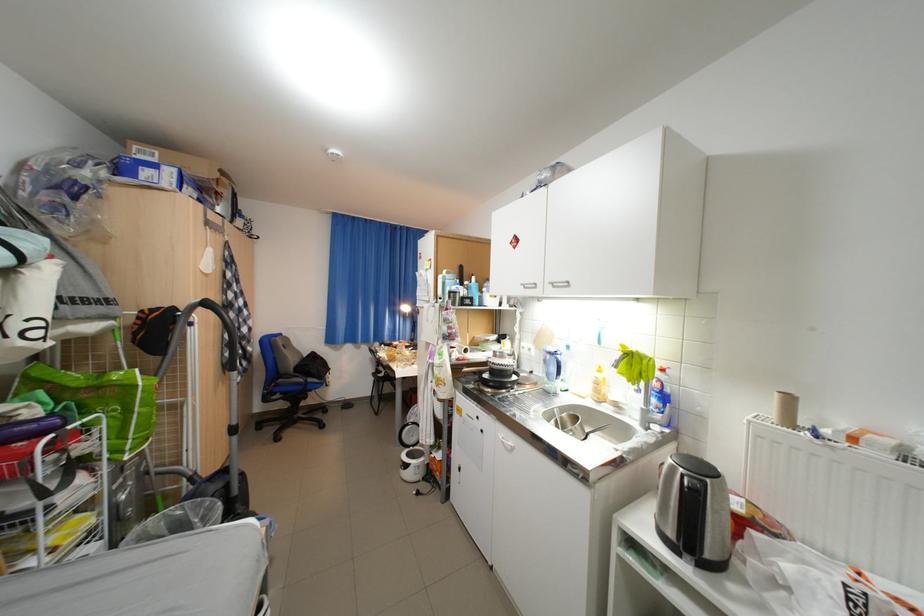
Locate an element on the screen. This screenshot has height=616, width=924. blue portable speaker is located at coordinates (694, 512).